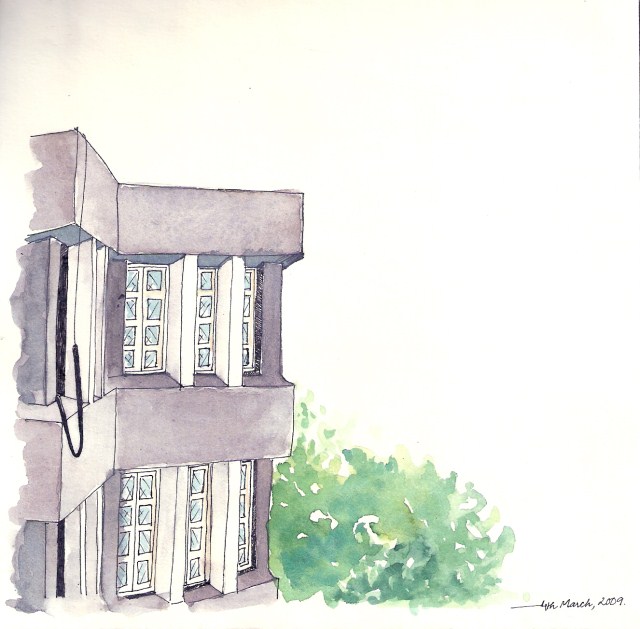
Identify the location of window. Image resolution: width=640 pixels, height=629 pixels. (148, 320), (208, 316), (244, 320), (132, 531), (196, 528), (246, 520).